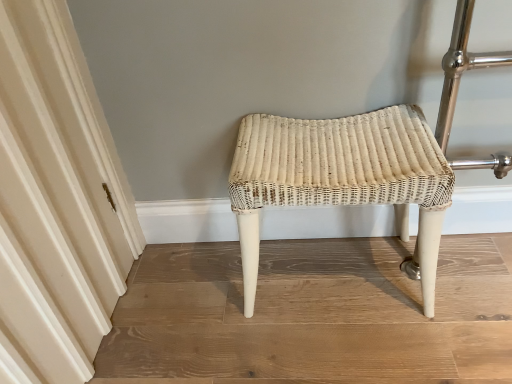
Question: From a real-world perspective, does white wicker stool at center stand above creamy white fabric at left?

Choices:
 (A) no
 (B) yes

Answer: (A)

Question: Is the depth of white wicker stool at center greater than that of creamy white fabric at left?

Choices:
 (A) no
 (B) yes

Answer: (B)

Question: Is white wicker stool at center next to creamy white fabric at left?

Choices:
 (A) no
 (B) yes

Answer: (A)

Question: Is white wicker stool at center not inside creamy white fabric at left?

Choices:
 (A) yes
 (B) no

Answer: (A)

Question: Is white wicker stool at center not near creamy white fabric at left?

Choices:
 (A) yes
 (B) no

Answer: (B)

Question: From the image's perspective, is white wicker stool at center on top of creamy white fabric at left?

Choices:
 (A) yes
 (B) no

Answer: (B)

Question: From a real-world perspective, is creamy white fabric at left physically above white wicker stool at center?

Choices:
 (A) yes
 (B) no

Answer: (A)

Question: Could you tell me if creamy white fabric at left is turned towards white wicker stool at center?

Choices:
 (A) no
 (B) yes

Answer: (B)

Question: From a real-world perspective, is creamy white fabric at left under white wicker stool at center?

Choices:
 (A) yes
 (B) no

Answer: (B)

Question: Is the position of creamy white fabric at left less distant than that of white wicker stool at center?

Choices:
 (A) no
 (B) yes

Answer: (B)

Question: Would you say white wicker stool at center is part of creamy white fabric at left's contents?

Choices:
 (A) yes
 (B) no

Answer: (B)

Question: Does creamy white fabric at left have a greater height compared to white wicker stool at center?

Choices:
 (A) yes
 (B) no

Answer: (A)

Question: In terms of width, does creamy white fabric at left look wider or thinner when compared to white wicker stool at center?

Choices:
 (A) wide
 (B) thin

Answer: (B)